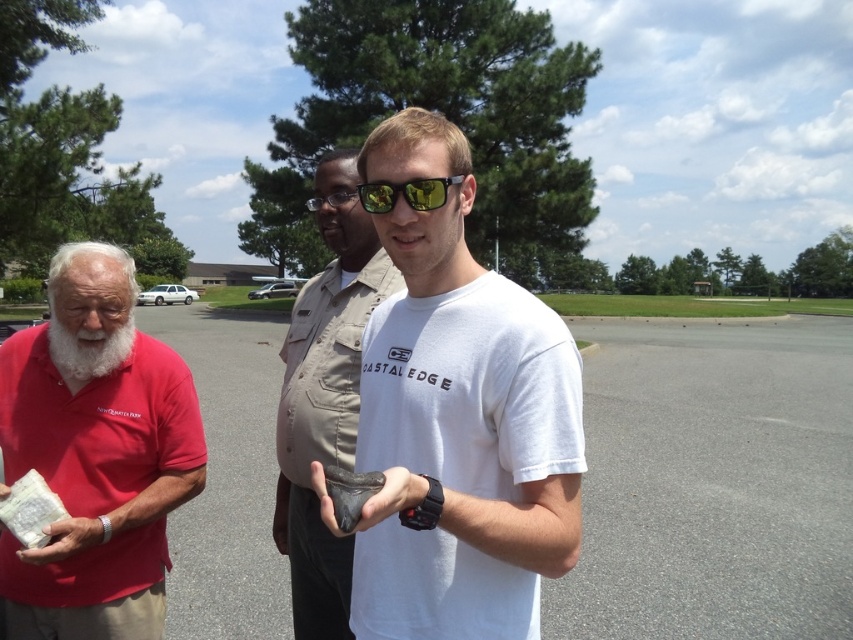
Question: Which point is farther to the camera?

Choices:
 (A) (113, 472)
 (B) (447, 339)
 (C) (113, 339)

Answer: (A)

Question: Which point appears farthest from the camera in this image?

Choices:
 (A) (480, 433)
 (B) (119, 486)

Answer: (B)

Question: Does matte red shirt at left appear over khaki uniform shirt at center?

Choices:
 (A) yes
 (B) no

Answer: (B)

Question: Estimate the real-world distances between objects in this image. Which object is farther from the khaki uniform shirt at center?

Choices:
 (A) yellow reflective lens at center
 (B) gray asphalt parking lot at center
 (C) white matte t-shirt at center
 (D) matte red shirt at left

Answer: (B)

Question: Can you confirm if white matte t-shirt at center is wider than khaki uniform shirt at center?

Choices:
 (A) no
 (B) yes

Answer: (B)

Question: Can you confirm if white matte t-shirt at center is wider than matte red shirt at left?

Choices:
 (A) yes
 (B) no

Answer: (B)